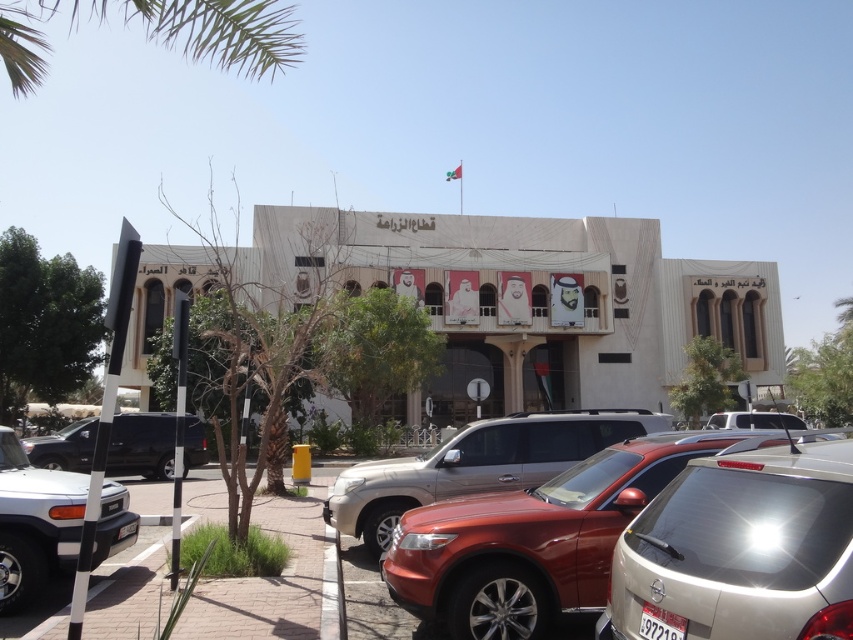
In the scene shown: You are standing at the entrance of the beige building and want to find the silver metallic suv at lower left. According to the coordinates provided, where should you look relative to your current position?

The silver metallic suv at lower left is located at coordinates point (33, 524), which would be to the lower left direction from your current position at the entrance of the beige building.

You are a delivery driver who needs to park your vehicle which is 16 feet long. You see the silver metallic suv at lower left and the shiny black suv at lower left. Can you fit your vehicle between them?

The silver metallic suv at lower left and shiny black suv at lower left are 32.62 feet apart from each other. Since your vehicle is 16 feet long, there is enough space between them to park your vehicle.